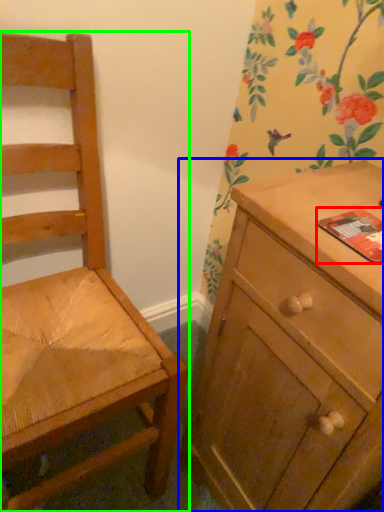
Question: Which is nearer to the paperback book (highlighted by a red box)? chest of drawers (highlighted by a blue box) or chair (highlighted by a green box).

Choices:
 (A) chest of drawers
 (B) chair

Answer: (A)